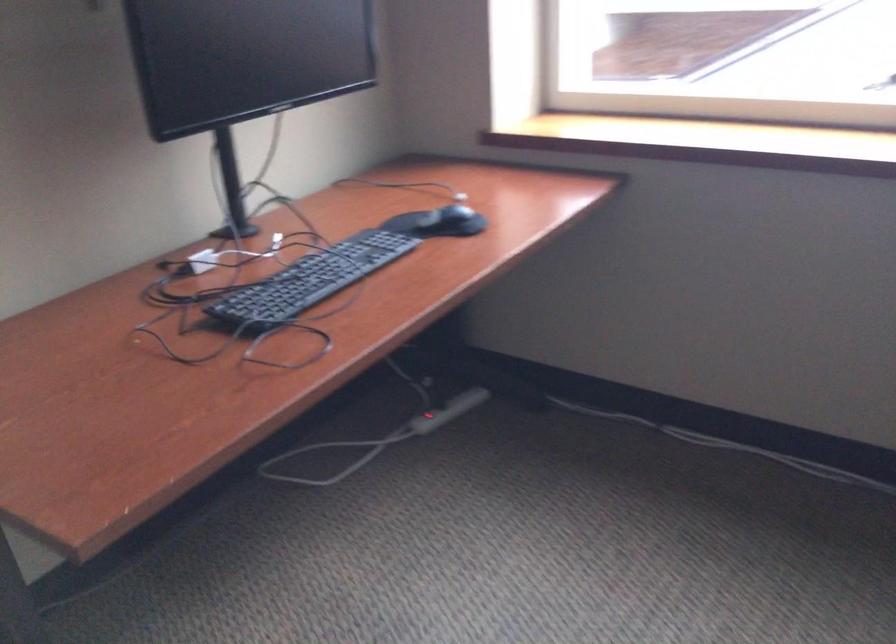
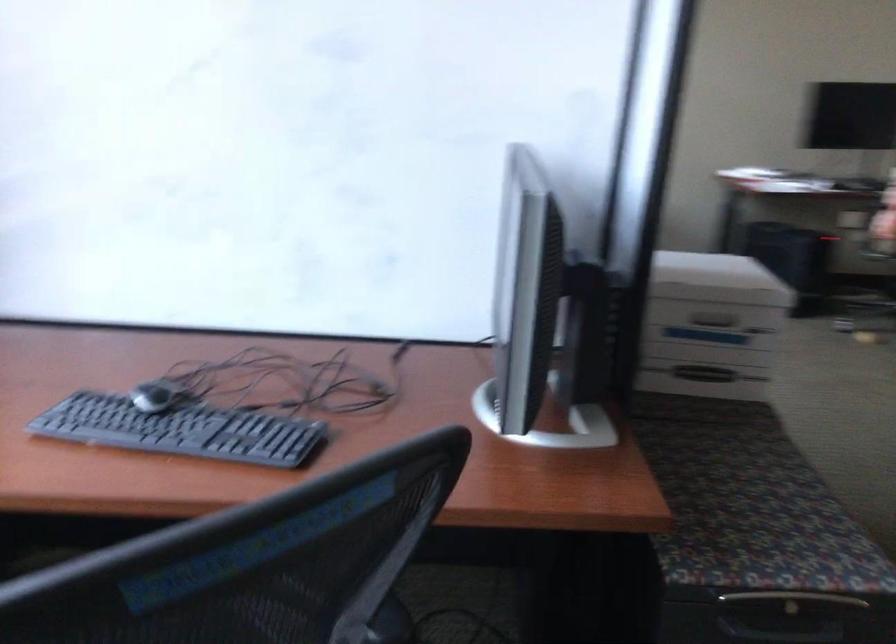
How did the camera likely rotate?

The camera's rotation is toward right-down.